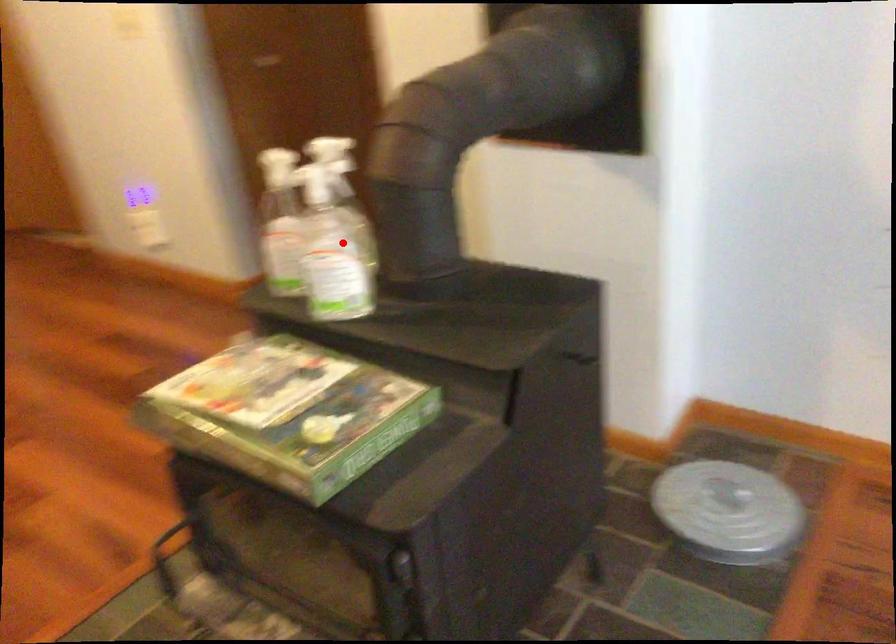
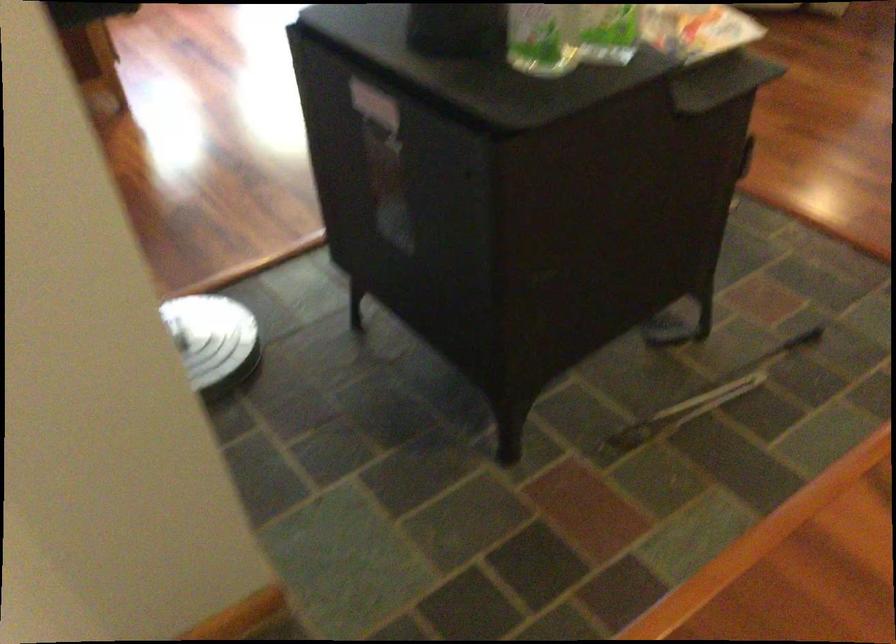
In the second image, find the point that corresponds to the highlighted location in the first image.

(541, 38)